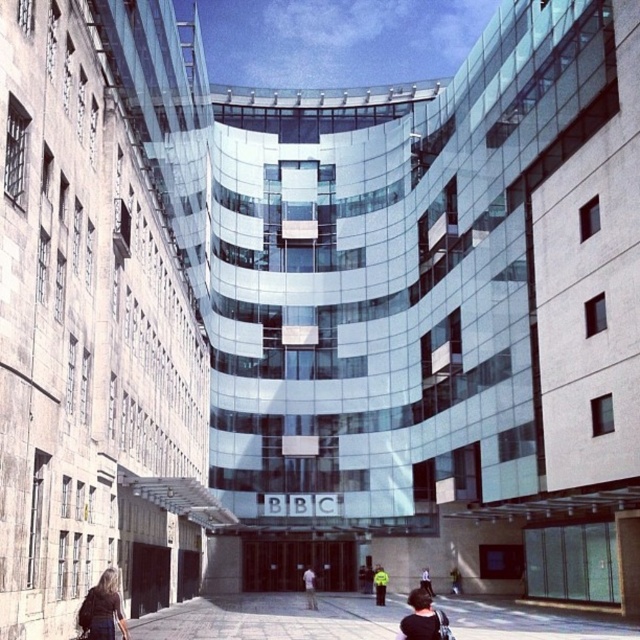
Can you confirm if black fabric hair at lower center is positioned to the right of light blue shirt at center?

Correct, you'll find black fabric hair at lower center to the right of light blue shirt at center.

What do you see at coordinates (419, 618) in the screenshot? This screenshot has width=640, height=640. I see `black fabric hair at lower center` at bounding box center [419, 618].

Where is `black fabric hair at lower center`? The image size is (640, 640). black fabric hair at lower center is located at coordinates (419, 618).

The image size is (640, 640). Describe the element at coordinates (273, 618) in the screenshot. I see `paved stone pavement at center` at that location.

Measure the distance between paved stone pavement at center and camera.

They are 129.29 feet apart.

The height and width of the screenshot is (640, 640). I want to click on paved stone pavement at center, so click(273, 618).

Who is lower down, paved stone pavement at center or dark blue jeans at lower center?

dark blue jeans at lower center is below.

Can you confirm if paved stone pavement at center is positioned to the left of dark blue jeans at lower center?

Indeed, paved stone pavement at center is positioned on the left side of dark blue jeans at lower center.

In order to click on paved stone pavement at center in this screenshot , I will do `click(273, 618)`.

Identify the location of paved stone pavement at center. (273, 618).